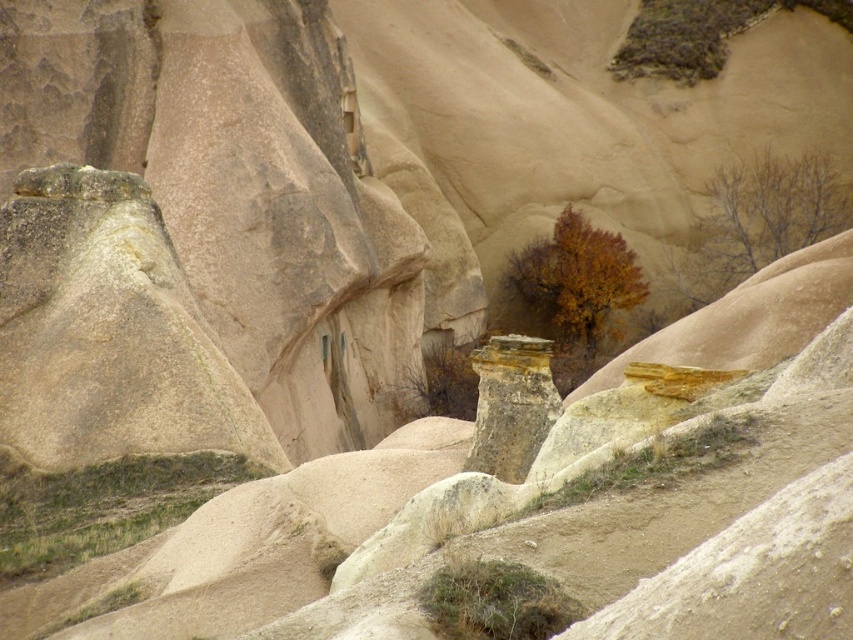
You are a hiker trying to determine which tree is taller between the brown leafy tree at upper right and the brown matte tree at center. Based on the landscape description, which tree should you identify as the taller one?

The brown leafy tree at upper right is taller than the brown matte tree at center according to the description.

You are a hiker looking for a shortcut through the rugged landscape. You notice the brown leafy tree at upper right and the brown matte tree at center. Which tree should you approach first if you want to reach the closer one?

You should approach the brown leafy tree at upper right first because it is closer to you than the brown matte tree at center.